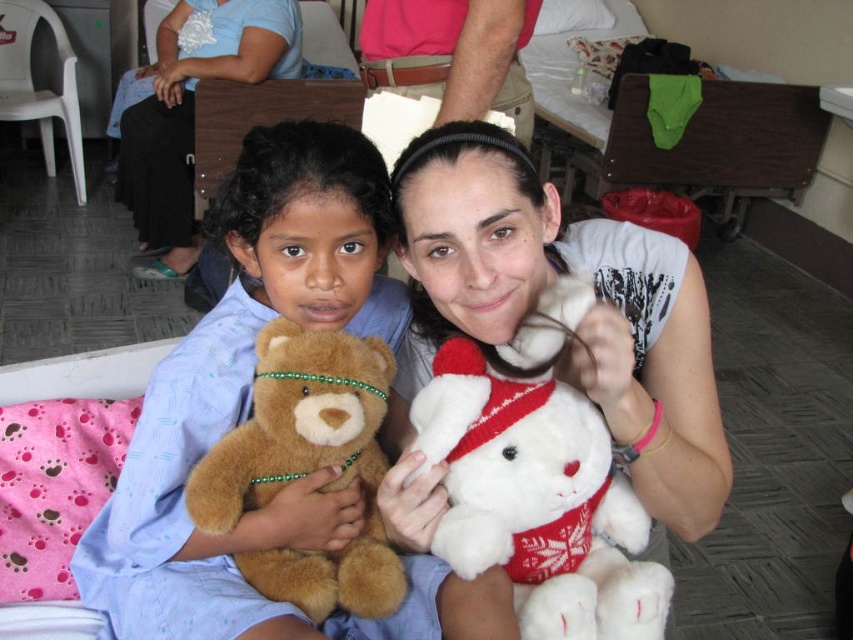
Question: Which point is farther to the camera?

Choices:
 (A) soft brown teddy bear at left
 (B) white plush bear at center
 (C) soft brown teddy bear at center
 (D) white plush teddy bear at center

Answer: (A)

Question: Is soft brown teddy bear at center to the left of soft brown teddy bear at left from the viewer's perspective?

Choices:
 (A) yes
 (B) no

Answer: (B)

Question: Which object appears farthest from the camera in this image?

Choices:
 (A) white plush teddy bear at center
 (B) white plush bear at center

Answer: (A)

Question: Which point appears closest to the camera in this image?

Choices:
 (A) (543, 596)
 (B) (254, 365)
 (C) (662, 417)
 (D) (277, 291)

Answer: (C)

Question: From the image, what is the correct spatial relationship of soft brown teddy bear at center in relation to white plush bear at center?

Choices:
 (A) right
 (B) left

Answer: (B)

Question: Does soft brown teddy bear at center have a greater width compared to soft brown teddy bear at left?

Choices:
 (A) no
 (B) yes

Answer: (B)